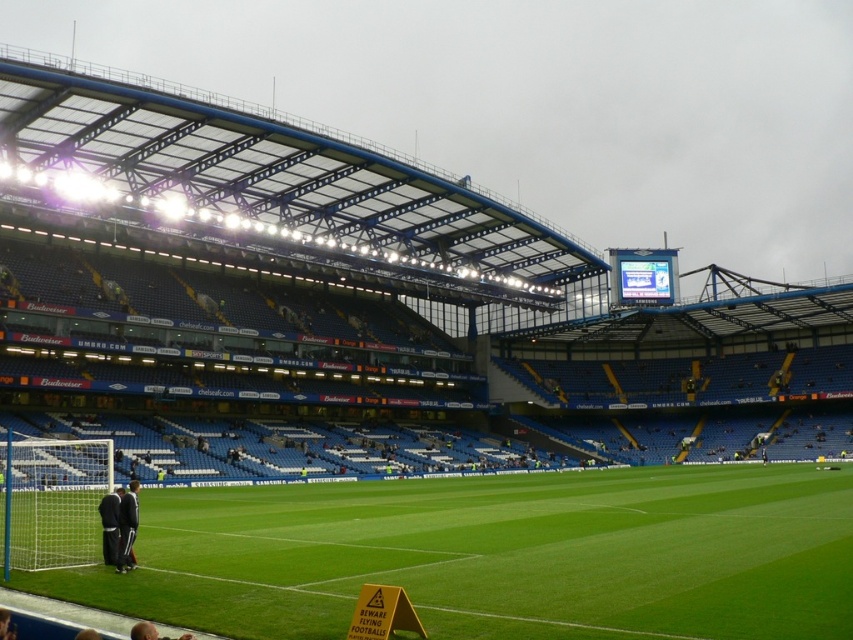
Who is positioned more to the left, green grass football field at lower left or dark gray tracksuit at lower left?

From the viewer's perspective, dark gray tracksuit at lower left appears more on the left side.

You are a GUI agent. You are given a task and a screenshot of the screen. Output one action in this format:
    pyautogui.click(x=<x>, y=<y>)
    Task: Click on the green grass football field at lower left
    This screenshot has height=640, width=853.
    Given the screenshot: What is the action you would take?
    498,556

Does point (76, 572) come behind point (132, 490)?

That is False.

Locate an element on the screen. The image size is (853, 640). green grass football field at lower left is located at coordinates (498, 556).

This screenshot has width=853, height=640. What do you see at coordinates (126, 525) in the screenshot?
I see `dark gray tracksuit at lower left` at bounding box center [126, 525].

Locate an element on the screen. This screenshot has height=640, width=853. dark gray tracksuit at lower left is located at coordinates (126, 525).

Looking at this image, between green grass football field at lower left and white mesh net at lower left, which one is positioned higher?

Positioned higher is white mesh net at lower left.

Who is taller, green grass football field at lower left or white mesh net at lower left?

white mesh net at lower left is taller.

This screenshot has height=640, width=853. What do you see at coordinates (498, 556) in the screenshot?
I see `green grass football field at lower left` at bounding box center [498, 556].

Identify the location of green grass football field at lower left. (498, 556).